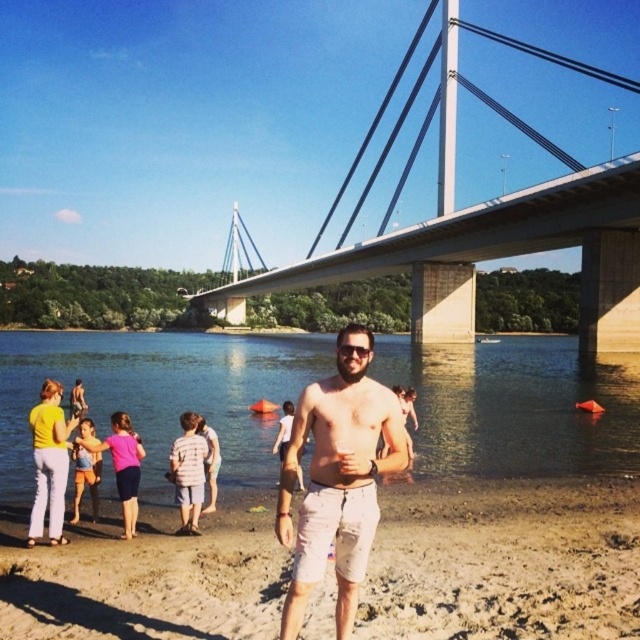
Does beige cotton shorts at center have a lesser width compared to yellow cotton shirt at lower left?

Correct, beige cotton shorts at center's width is less than yellow cotton shirt at lower left's.

Between point (358, 522) and point (36, 410), which one is positioned in front?

Point (358, 522)

This screenshot has height=640, width=640. Find the location of `beige cotton shorts at center`. beige cotton shorts at center is located at coordinates (337, 477).

Who is shorter, brown sandy beach at center or blue denim shorts at lower left?

Standing shorter between the two is brown sandy beach at center.

Measure the distance between brown sandy beach at center and camera.

brown sandy beach at center and camera are 29.69 meters apart from each other.

Does point (237, 532) come farther from viewer compared to point (81, 493)?

That is False.

This screenshot has height=640, width=640. Find the location of `brown sandy beach at center`. brown sandy beach at center is located at coordinates (504, 563).

Who is higher up, yellow cotton shirt at lower left or light blue denim shorts at lower left?

light blue denim shorts at lower left

Is point (65, 486) positioned before point (76, 404)?

That is True.

You are a GUI agent. You are given a task and a screenshot of the screen. Output one action in this format:
    pyautogui.click(x=<x>, y=<y>)
    Task: Click on the yellow cotton shirt at lower left
    
    Given the screenshot: What is the action you would take?
    pyautogui.click(x=49, y=461)

Locate an element on the screen. The image size is (640, 640). yellow cotton shirt at lower left is located at coordinates (49, 461).